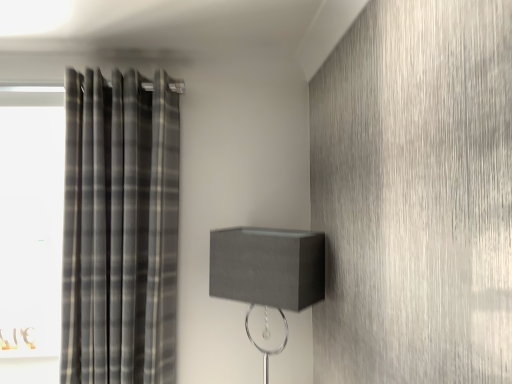
The width and height of the screenshot is (512, 384). What are the coordinates of `matte gray lampshade at center` in the screenshot? It's located at click(268, 271).

What is the approximate height of matte gray lampshade at center?

It is 72.02 centimeters.

In order to face matte gray lampshade at center, should I rotate leftwards or rightwards?

Rotate your view right by about 1.840°.

What do you see at coordinates (268, 271) in the screenshot? Image resolution: width=512 pixels, height=384 pixels. I see `matte gray lampshade at center` at bounding box center [268, 271].

What do you see at coordinates (120, 228) in the screenshot? I see `plaid fabric curtain at left` at bounding box center [120, 228].

Where is `plaid fabric curtain at left`? Image resolution: width=512 pixels, height=384 pixels. plaid fabric curtain at left is located at coordinates (120, 228).

At what (x,y) coordinates should I click in order to perform the action: click on matte gray lampshade at center. Please return your answer as a coordinate pair (x, y). Looking at the image, I should click on tap(268, 271).

Is plaid fabric curtain at left to the right of matte gray lampshade at center from the viewer's perspective?

No.

Who is more distant, plaid fabric curtain at left or matte gray lampshade at center?

plaid fabric curtain at left.

Which is closer to the camera, (95, 321) or (221, 234)?

Clearly, point (95, 321) is closer to the camera than point (221, 234).

From the picture: From the image's perspective, would you say plaid fabric curtain at left is positioned over matte gray lampshade at center?

Correct, plaid fabric curtain at left appears higher than matte gray lampshade at center in the image.

From a real-world perspective, is plaid fabric curtain at left over matte gray lampshade at center?

Yes.

Which of these two, plaid fabric curtain at left or matte gray lampshade at center, is wider?

Wider between the two is matte gray lampshade at center.

Based on the photo, from their relative heights in the image, would you say plaid fabric curtain at left is taller or shorter than matte gray lampshade at center?

plaid fabric curtain at left is taller than matte gray lampshade at center.

Considering the sizes of objects plaid fabric curtain at left and matte gray lampshade at center in the image provided, who is bigger, plaid fabric curtain at left or matte gray lampshade at center?

plaid fabric curtain at left is bigger.

Can we say plaid fabric curtain at left lies outside matte gray lampshade at center?

Indeed, plaid fabric curtain at left is completely outside matte gray lampshade at center.

Is plaid fabric curtain at left next to matte gray lampshade at center and touching it?

plaid fabric curtain at left and matte gray lampshade at center are clearly separated.

Is plaid fabric curtain at left turned away from matte gray lampshade at center?

plaid fabric curtain at left does not have its back to matte gray lampshade at center.

Can you tell me how much plaid fabric curtain at left and matte gray lampshade at center differ in facing direction?

There is a 35.5-degree angle between the facing directions of plaid fabric curtain at left and matte gray lampshade at center.

Locate an element on the screen. table lamp on the right of plaid fabric curtain at left is located at coordinates (x=268, y=271).

Based on their positions, is matte gray lampshade at center located to the left or right of plaid fabric curtain at left?

From the image, it's evident that matte gray lampshade at center is to the right of plaid fabric curtain at left.

Is matte gray lampshade at center positioned behind plaid fabric curtain at left?

No, matte gray lampshade at center is closer to the camera.

Is point (286, 303) closer or farther from the camera than point (74, 122)?

Point (286, 303) is closer to the camera than point (74, 122).

From the image's perspective, between matte gray lampshade at center and plaid fabric curtain at left, who is located below?

matte gray lampshade at center appears lower in the image.

From a real-world perspective, is matte gray lampshade at center on plaid fabric curtain at left?

No, from a real-world perspective, matte gray lampshade at center is not over plaid fabric curtain at left

From the picture: In terms of width, does matte gray lampshade at center look wider or thinner when compared to plaid fabric curtain at left?

Clearly, matte gray lampshade at center has more width compared to plaid fabric curtain at left.

In the scene shown: In terms of height, does matte gray lampshade at center look taller or shorter compared to plaid fabric curtain at left?

Clearly, matte gray lampshade at center is shorter compared to plaid fabric curtain at left.

Between matte gray lampshade at center and plaid fabric curtain at left, which one has smaller size?

matte gray lampshade at center is smaller.

Is plaid fabric curtain at left completely or partially inside matte gray lampshade at center?

Definitely not — plaid fabric curtain at left is not inside matte gray lampshade at center.

Are matte gray lampshade at center and plaid fabric curtain at left located far from each other?

No, matte gray lampshade at center is not far away from plaid fabric curtain at left.

Consider the image. Could you tell me if matte gray lampshade at center is turned towards plaid fabric curtain at left?

No.

Locate an element on the screen. This screenshot has width=512, height=384. curtain above the matte gray lampshade at center (from a real-world perspective) is located at coordinates (120, 228).

Find the location of a particular element. The height and width of the screenshot is (384, 512). table lamp below the plaid fabric curtain at left (from the image's perspective) is located at coordinates (268, 271).

Where is `curtain behind the matte gray lampshade at center`? This screenshot has width=512, height=384. curtain behind the matte gray lampshade at center is located at coordinates (120, 228).